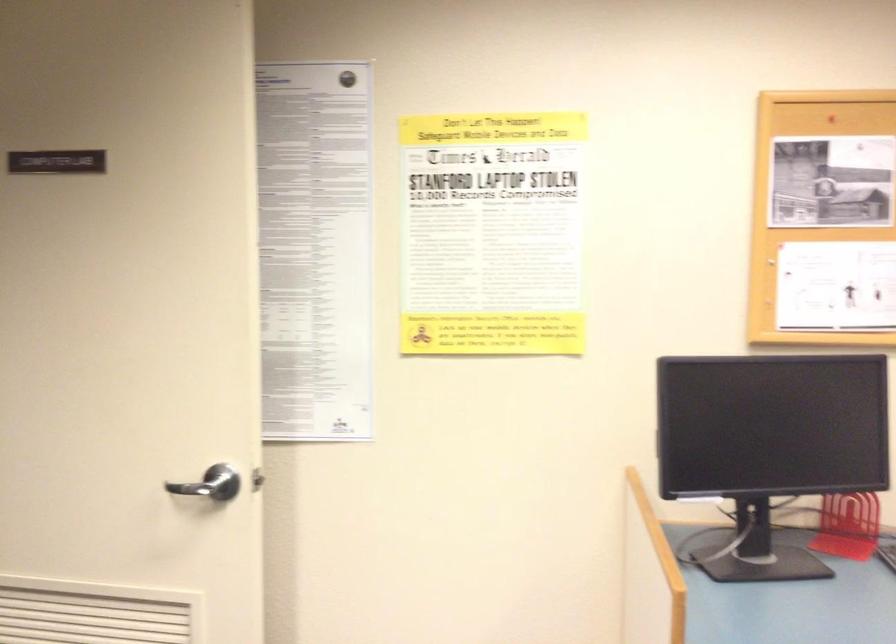
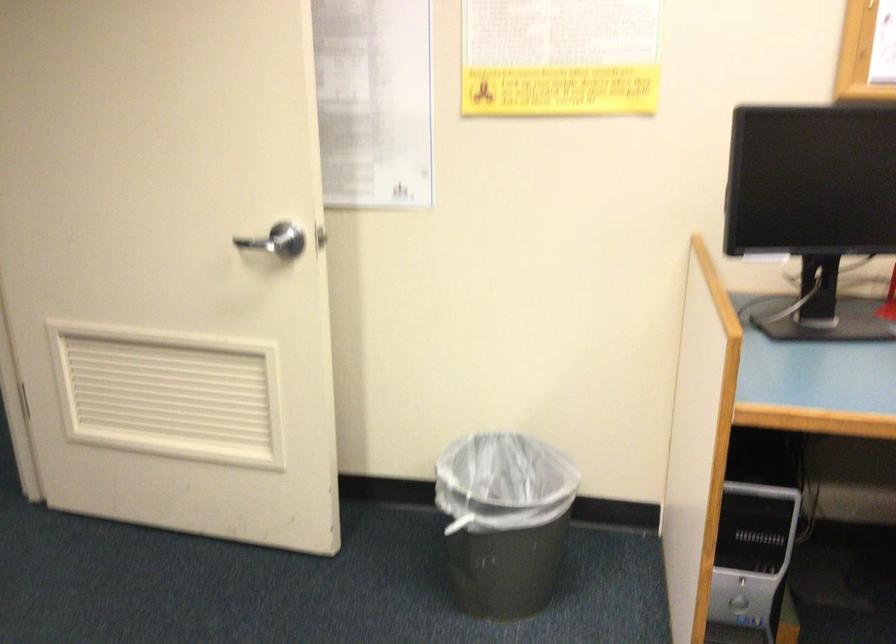
Find the pixel in the second image that matches the point at 219,482 in the first image.

(286, 240)